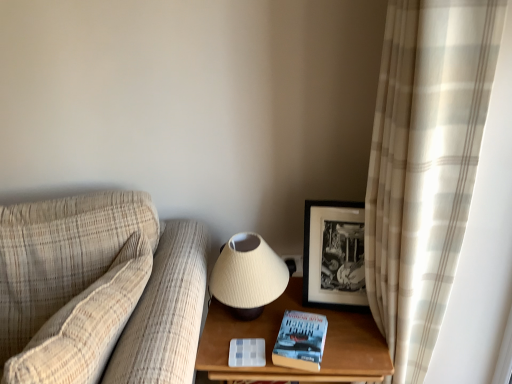
In order to click on free space on the front side of black matte picture frame at upper right in this screenshot , I will do `click(353, 330)`.